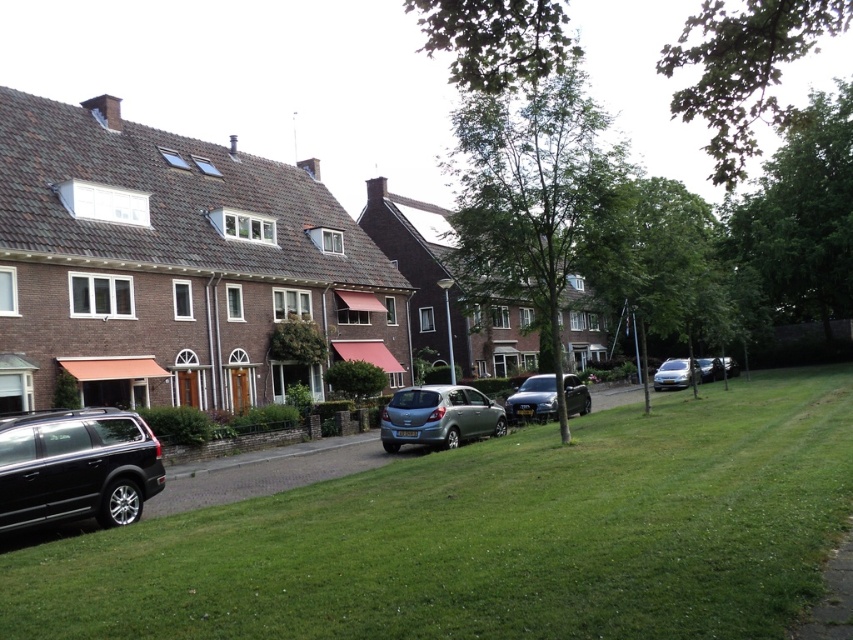
Question: Is shiny black suv at lower left to the left of satin silver hatchback at center from the viewer's perspective?

Choices:
 (A) yes
 (B) no

Answer: (A)

Question: Which point is closer to the camera?

Choices:
 (A) (78, 426)
 (B) (396, 444)
 (C) (537, 500)
 (D) (662, 378)

Answer: (C)

Question: Among these points, which one is nearest to the camera?

Choices:
 (A) (693, 380)
 (B) (529, 586)

Answer: (B)

Question: Can you confirm if green grass lawn at lower center is positioned to the left of shiny black suv at lower left?

Choices:
 (A) no
 (B) yes

Answer: (A)

Question: Is the position of green grass lawn at lower center more distant than that of satin silver sedan at right?

Choices:
 (A) yes
 (B) no

Answer: (B)

Question: Which object appears farthest from the camera in this image?

Choices:
 (A) shiny black suv at lower left
 (B) shiny black sedan at center

Answer: (B)